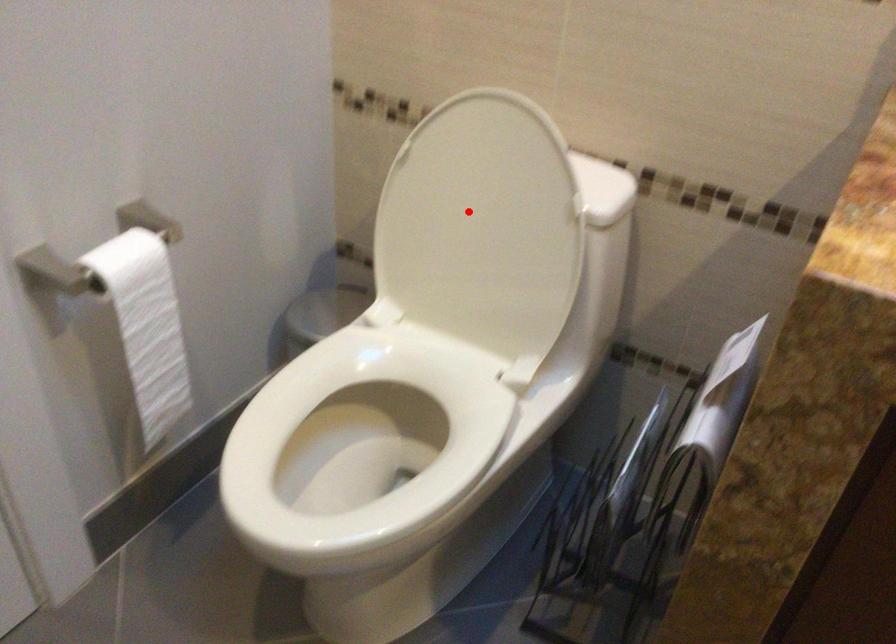
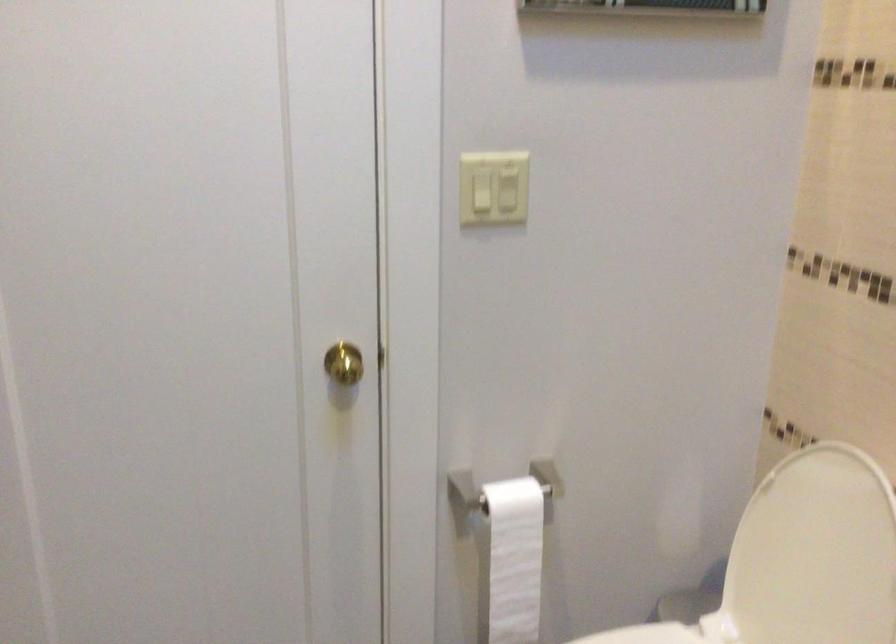
Locate, in the second image, the point that corresponds to the highlighted location in the first image.

(813, 554)